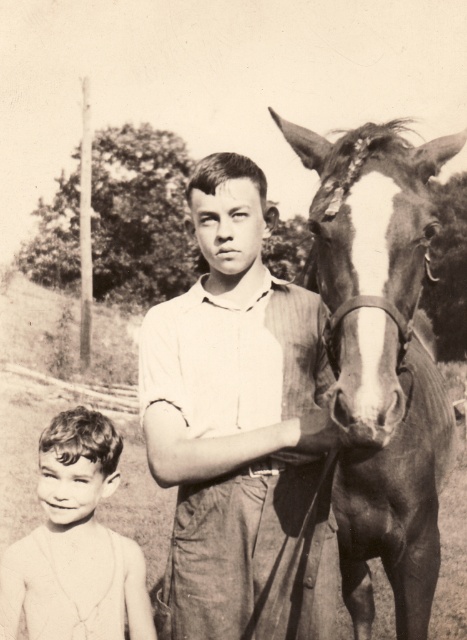
Is white striped shirt at center closer to camera compared to smooth skin boy at lower left?

That is True.

Consider the image. Between white striped shirt at center and smooth skin boy at lower left, which one is positioned higher?

Positioned higher is white striped shirt at center.

Is point (332, 557) less distant than point (84, 440)?

Yes, point (332, 557) is closer to viewer.

Identify the location of white striped shirt at center. The height and width of the screenshot is (640, 467). (240, 426).

Does point (193, 467) come in front of point (416, 256)?

No, (193, 467) is behind (416, 256).

Can you confirm if white striped shirt at center is positioned to the right of dark brown leather horse at right?

No, white striped shirt at center is not to the right of dark brown leather horse at right.

Find the location of a particular element. This screenshot has width=467, height=640. white striped shirt at center is located at coordinates (240, 426).

Which is more to the right, dark brown leather horse at right or smooth skin boy at lower left?

From the viewer's perspective, dark brown leather horse at right appears more on the right side.

Which is in front, point (359, 348) or point (39, 566)?

Point (359, 348) is more forward.

Find the location of a particular element. This screenshot has width=467, height=640. dark brown leather horse at right is located at coordinates (381, 358).